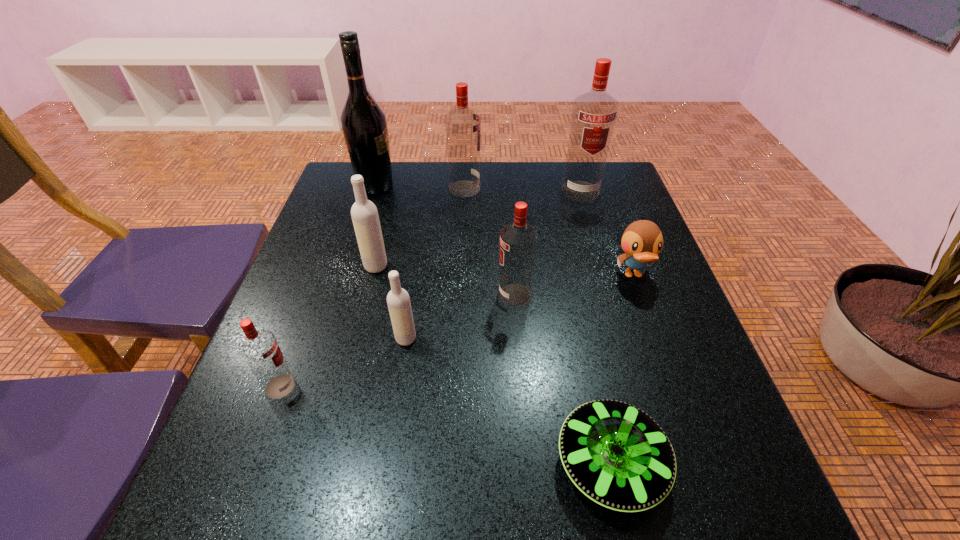
Locate an element on the screen. The image size is (960, 540). wine bottle is located at coordinates (363, 121).

Identify the location of the rightmost red vodka. The width and height of the screenshot is (960, 540). (594, 113).

Where is `the tallest vodka`? The image size is (960, 540). the tallest vodka is located at coordinates (594, 113).

The image size is (960, 540). I want to click on the third tallest object, so click(x=463, y=126).

I want to click on the third smallest red vodka, so click(x=463, y=126).

The width and height of the screenshot is (960, 540). Identify the location of the third farthest vodka. (364, 213).

Find the location of a particular element. the left white vodka is located at coordinates (364, 213).

Locate an element on the screen. The image size is (960, 540). the third biggest red vodka is located at coordinates (518, 240).

In order to click on the fourth object from right to left in this screenshot , I will do `click(518, 240)`.

Image resolution: width=960 pixels, height=540 pixels. I want to click on the leftmost red vodka, so click(259, 348).